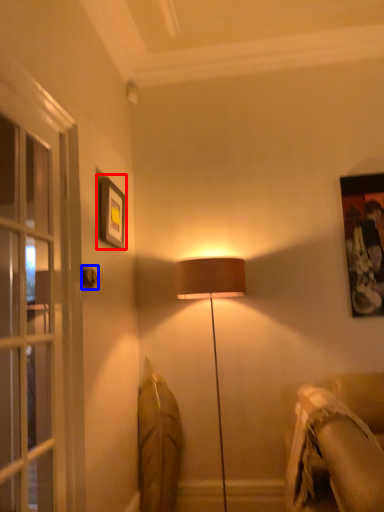
Question: Which of the following is the closest to the observer, picture frame (highlighted by a red box) or door handle (highlighted by a blue box)?

Choices:
 (A) picture frame
 (B) door handle

Answer: (B)